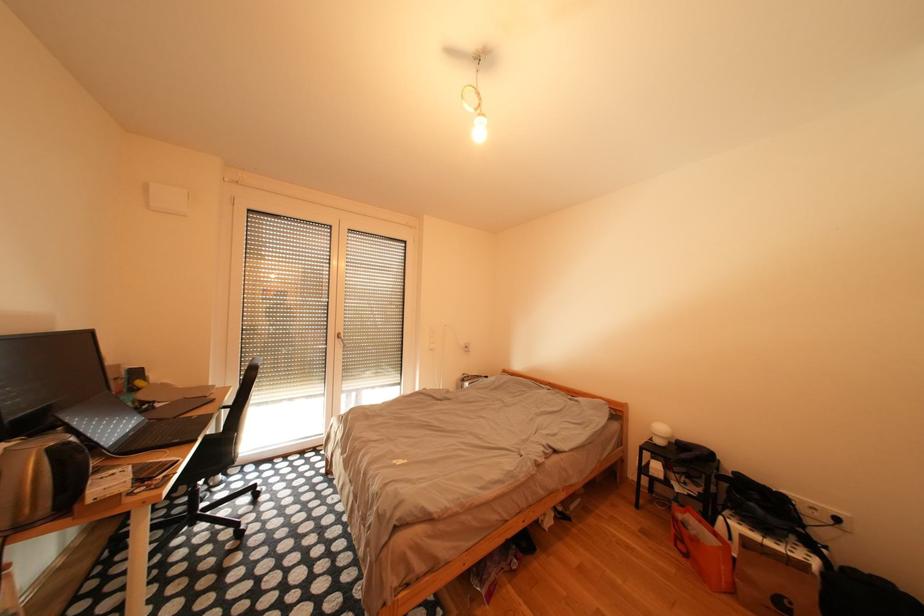
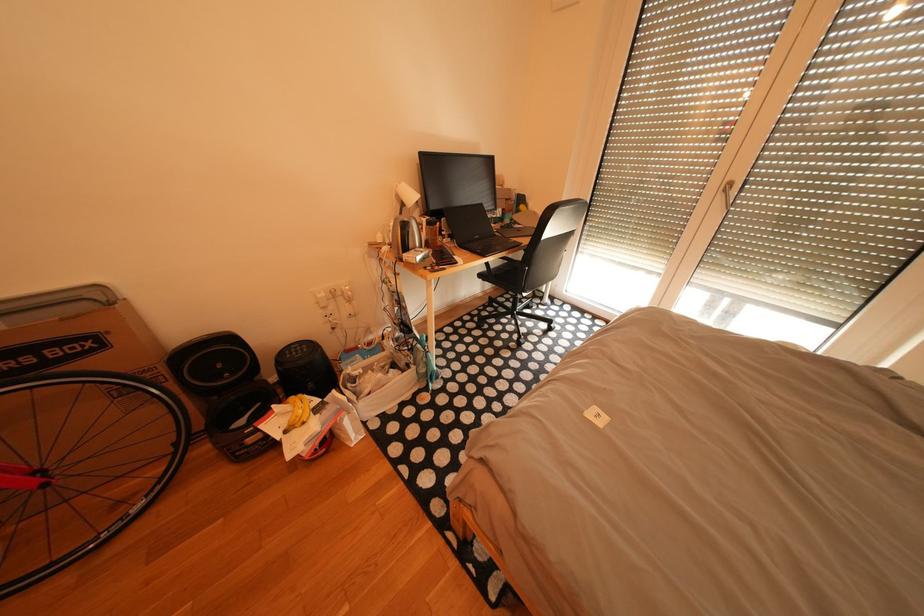
The images are taken continuously from a first-person perspective. In which direction is your viewpoint rotating?

The camera's rotation is toward left-down.